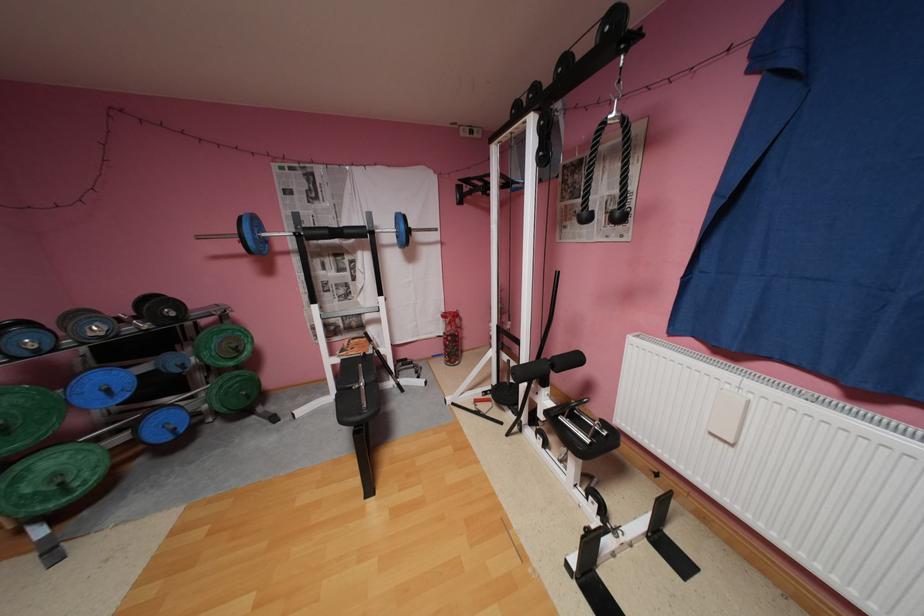
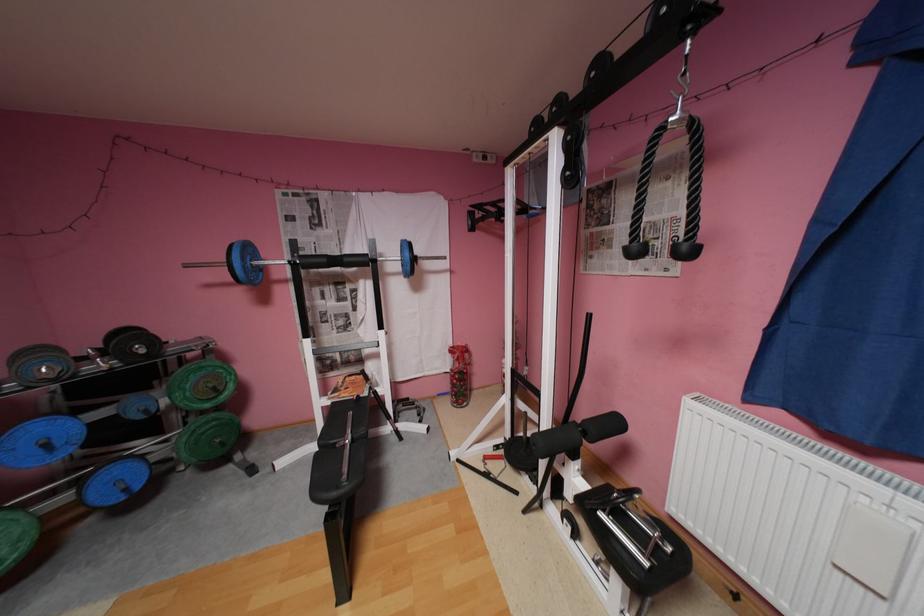
Locate, in the second image, the point that corresponds to (585,359) in the first image.

(624, 424)